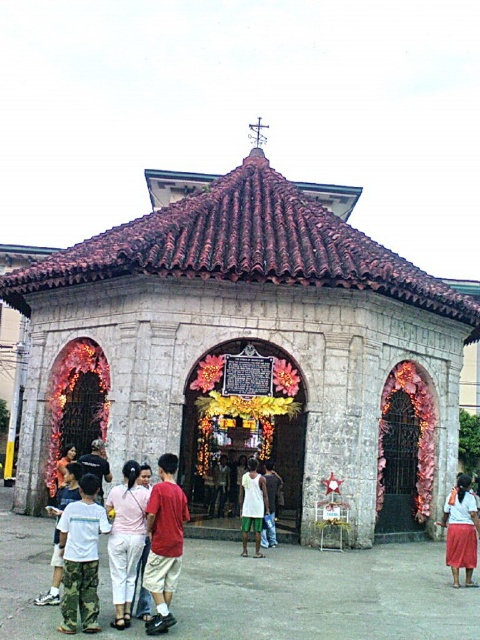
You are attending a festival at the chapel and see a person wearing pink fabric pants at center and white matte shirt at center. Which piece of clothing is on the left side of the person?

The pink fabric pants at center is positioned on the left side of white matte shirt at center.

You are attending a festival at the chapel and are wearing both the white cotton skirt at lower right and the white matte shirt at center. Which piece of clothing would be more noticeable to someone standing at the entrance of the central archway?

The white cotton skirt at lower right is bigger than the white matte shirt at center, so it would be more noticeable to someone standing at the entrance of the central archway.

You are standing in front of the stone chapel with festive decorations. You notice two items at the center of the image. Which item is closer to you, the pink fabric pants at center or the white matte shirt at center?

The pink fabric pants at center is closer to the viewer than the white matte shirt at center.